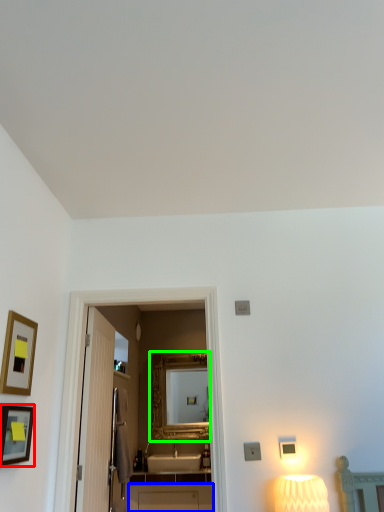
Question: Considering the real-world distances, which object is closest to picture frame (highlighted by a red box)? cabinetry (highlighted by a blue box) or mirror (highlighted by a green box).

Choices:
 (A) cabinetry
 (B) mirror

Answer: (A)